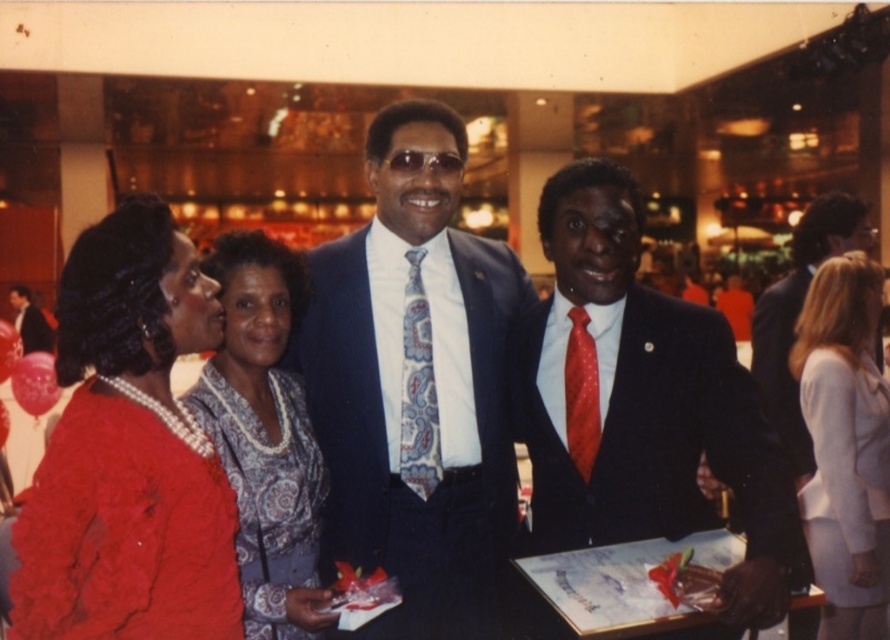
In the image, there are two men and two women. The man on the left is wearing a dark suit with a patterned tie and sunglasses. The blue satin suit at center is represented by point (414, 385). Which person is wearing the blue satin suit?

The blue satin suit at center is represented by point (414, 385), so the person wearing the blue satin suit is at that coordinate.

Based on the photo, you are a photographer at the event and need to adjust the camera focus to ensure both the blue satin suit at center and the shiny black suit at center are in frame. Given their height difference, which suit should you focus on first to capture both effectively?

The blue satin suit at center is taller than the shiny black suit at center, so focusing on the taller blue satin suit at center first will ensure the shorter shiny black suit at center remains in frame as well.